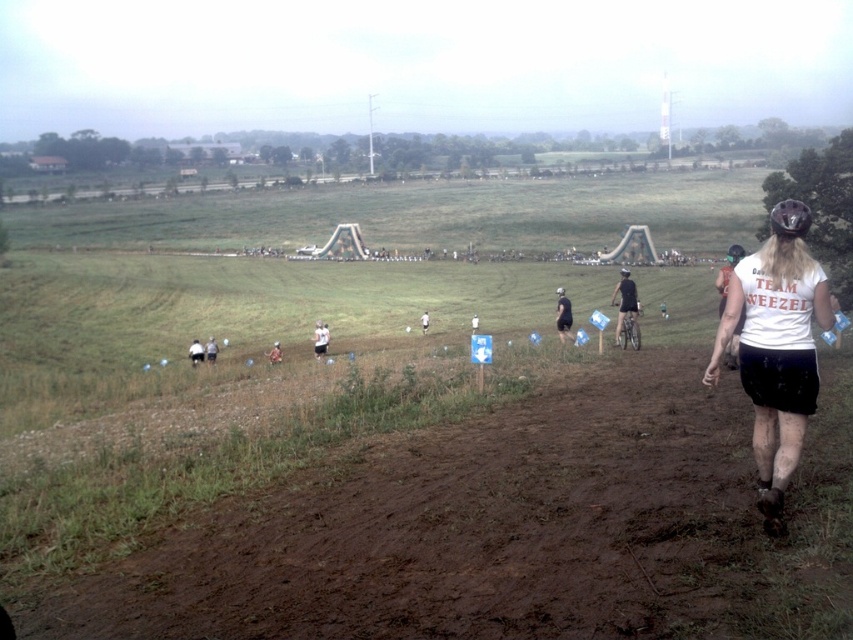
You are a photographer at the event and need to capture both the white matte shirt at lower right and the white cotton shirt at lower left in a single frame. Which shirt should you focus on first to ensure both are in the shot?

The white matte shirt at lower right is taller than the white cotton shirt at lower left, so you should focus on the white matte shirt at lower right first to ensure both are in the shot.

Based on the photo, you are a photographer positioned at the edge of the field. You want to take a photo that includes both the white cotton shirt at right and the white cotton shirt at center. Which shirt should you adjust your camera angle to focus on first to ensure both are in frame?

The white cotton shirt at right is taller than the white cotton shirt at center, so you should focus on the white cotton shirt at right first to ensure both are in frame.

You are a photographer positioned at the center of the field. You want to capture both the white cotton shirt at right and the white cotton shirt at center in a single photo. Given that your camera has a maximum angle of view of 30 degrees, can you fit both shirts into the frame without moving?

The white cotton shirt at right and white cotton shirt at center are 28.37 meters apart. To determine if they can fit within a 30 degree angle, we calculate the distance between them relative to the camera. However, without knowing the camera sensor size or focal length, we cannot accurately determine if the 28.37 meter separation fits into a 30 degree angle. Additional technical specifications are needed for an exact answer.